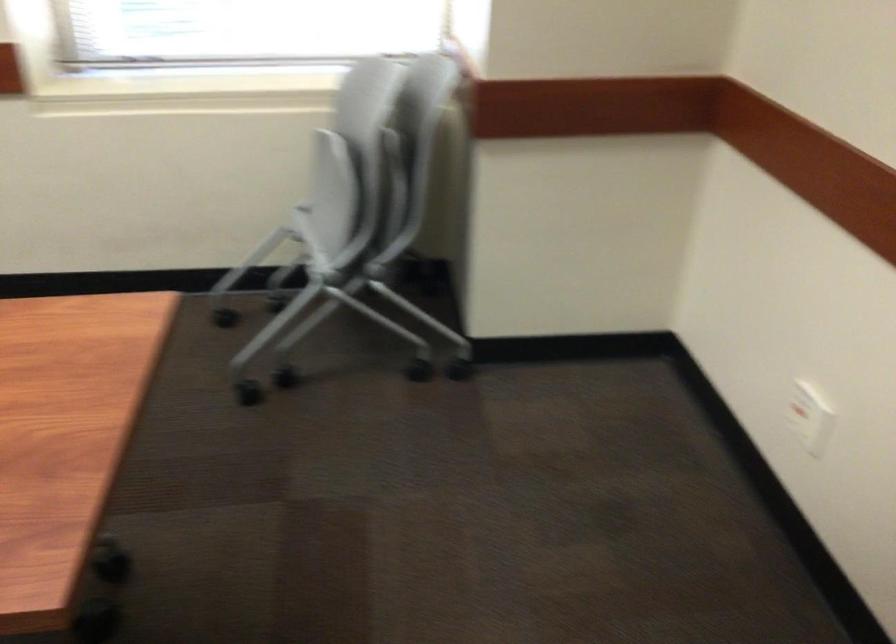
Question: The camera is either moving clockwise (left) or counter-clockwise (right) around the object. The first image is from the beginning of the video and the second image is from the end. Is the camera moving left or right when shooting the video?

Choices:
 (A) Left
 (B) Right

Answer: (A)